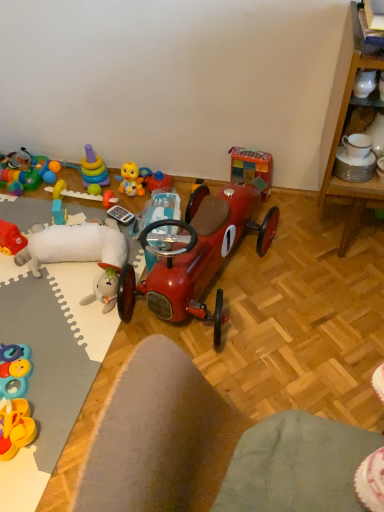
I want to click on free area in between shiny metallic car at center, the 9th toy positioned from the left, and rubber duck at lower left, which is counted as the 7th toy, starting from the right, so pyautogui.click(x=91, y=327).